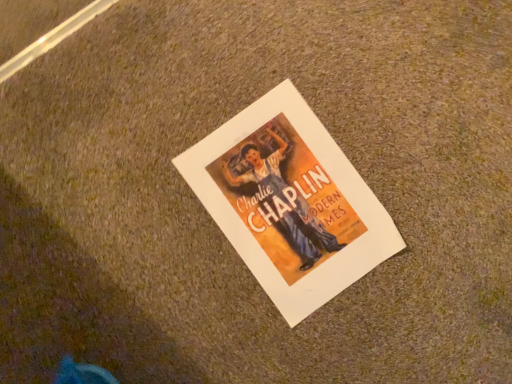
At what (x,y) coordinates should I click in order to perform the action: click on matte paper poster at center. Please return your answer as a coordinate pair (x, y). Looking at the image, I should click on (290, 202).

The height and width of the screenshot is (384, 512). What do you see at coordinates (290, 202) in the screenshot?
I see `matte paper poster at center` at bounding box center [290, 202].

Locate an element on the screen. This screenshot has height=384, width=512. matte paper poster at center is located at coordinates (290, 202).